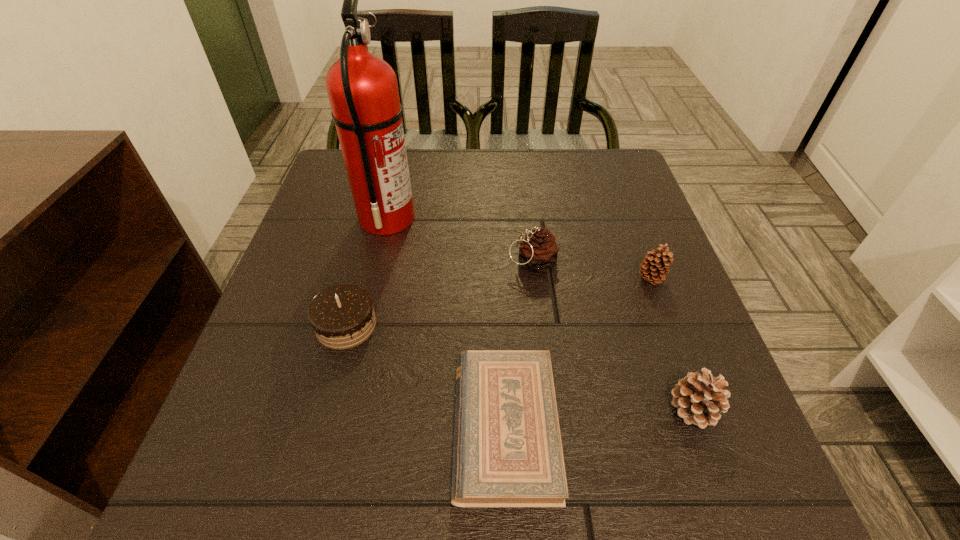
Identify the location of fire extinguisher. Image resolution: width=960 pixels, height=540 pixels. 362,88.

Identify the location of the leftmost pinecone. (539, 251).

Image resolution: width=960 pixels, height=540 pixels. Identify the location of the third nearest object. (342, 316).

The width and height of the screenshot is (960, 540). I want to click on the nearest pinecone, so click(x=699, y=398).

This screenshot has height=540, width=960. In order to click on Bible in this screenshot , I will do `click(507, 452)`.

You are a GUI agent. You are given a task and a screenshot of the screen. Output one action in this format:
    pyautogui.click(x=<x>, y=<y>)
    Task: Click on the free spot located 0.200m at the nozzle of the fire extinguisher
    Image resolution: width=960 pixels, height=540 pixels.
    Given the screenshot: What is the action you would take?
    pyautogui.click(x=501, y=218)

At what (x,y) coordinates should I click in order to perform the action: click on vacant space located 0.110m with a leaf charm attached to the leftmost pinecone. Please return your answer as a coordinate pair (x, y). The height and width of the screenshot is (540, 960). Looking at the image, I should click on (455, 262).

At what (x,y) coordinates should I click in order to perform the action: click on blank space located with a leaf charm attached to the leftmost pinecone. Please return your answer as a coordinate pair (x, y). The image size is (960, 540). Looking at the image, I should click on (346, 262).

The height and width of the screenshot is (540, 960). I want to click on free spot located 0.290m with a leaf charm attached to the leftmost pinecone, so click(x=370, y=262).

Where is `vacant space located 0.060m on the left of the fourth farthest object`? The width and height of the screenshot is (960, 540). vacant space located 0.060m on the left of the fourth farthest object is located at coordinates (x=283, y=325).